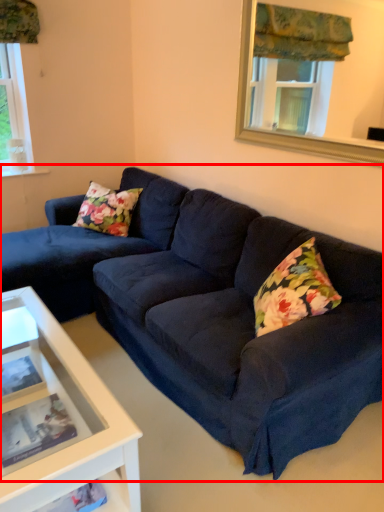
Question: Considering the relative positions of studio couch (annotated by the red box) and window frame in the image provided, where is studio couch (annotated by the red box) located with respect to the staircase?

Choices:
 (A) right
 (B) left

Answer: (B)